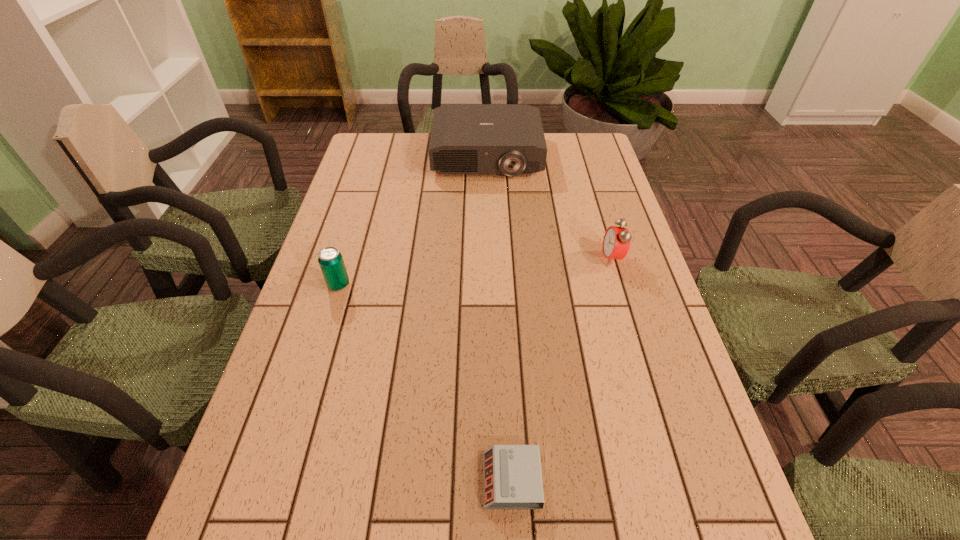
Find the location of a particular element. The image size is (960, 540). projector is located at coordinates (508, 139).

The image size is (960, 540). I want to click on the right alarm clock, so click(x=616, y=243).

In order to click on the taller alarm clock in this screenshot , I will do `click(616, 243)`.

Where is `beer can`? beer can is located at coordinates (331, 262).

You are a GUI agent. You are given a task and a screenshot of the screen. Output one action in this format:
    pyautogui.click(x=<x>, y=<y>)
    Task: Click on the second nearest object
    The width and height of the screenshot is (960, 540).
    Given the screenshot: What is the action you would take?
    pyautogui.click(x=331, y=262)

At what (x,y) coordinates should I click in order to perform the action: click on the nearest object. Please return your answer as a coordinate pair (x, y). Looking at the image, I should click on (512, 473).

This screenshot has width=960, height=540. Identify the location of the shortest object. coord(512,473).

Image resolution: width=960 pixels, height=540 pixels. In order to click on vacant space located 0.340m on the front-facing side of the projector in this screenshot , I will do [489, 253].

Where is `vacant area located on the front-facing side of the rightmost object`? The width and height of the screenshot is (960, 540). vacant area located on the front-facing side of the rightmost object is located at coordinates (462, 259).

You are a GUI agent. You are given a task and a screenshot of the screen. Output one action in this format:
    pyautogui.click(x=<x>, y=<y>)
    Task: Click on the vacant point located 0.240m on the front-facing side of the rightmost object
    The height and width of the screenshot is (540, 960).
    Given the screenshot: What is the action you would take?
    pyautogui.click(x=511, y=259)